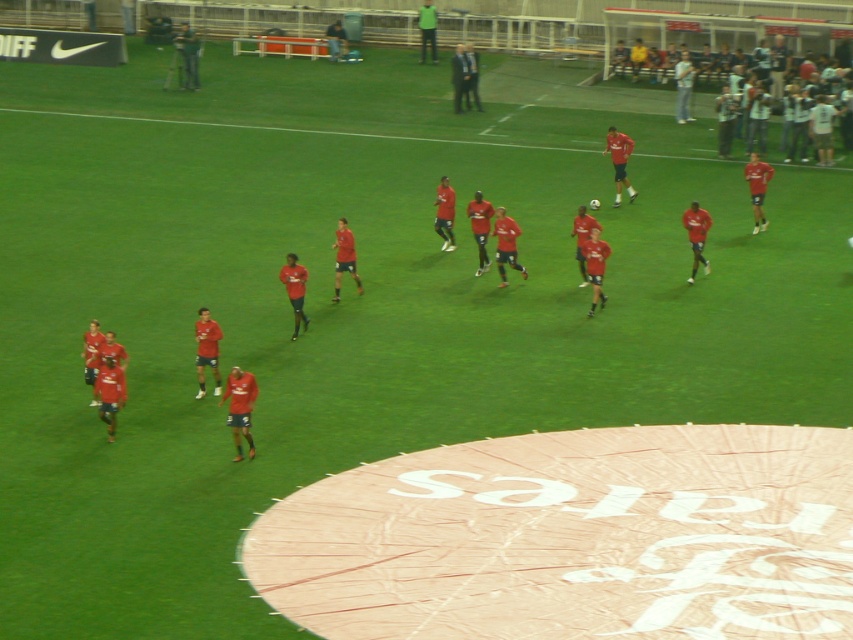
Question: Among these objects, which one is farthest from the camera?

Choices:
 (A) dark gray suit at center
 (B) matte red shirt at upper right
 (C) dark blue jeans at center

Answer: (C)

Question: Is dark gray suit at center thinner than dark blue jeans at center?

Choices:
 (A) no
 (B) yes

Answer: (A)

Question: Is matte red shirt at upper right below dark blue jeans at center?

Choices:
 (A) yes
 (B) no

Answer: (A)

Question: Which point appears farthest from the camera in this image?

Choices:
 (A) (474, 76)
 (B) (685, 74)
 (C) (421, 26)

Answer: (C)

Question: Based on their relative distances, which object is farther from the dark blue jeans at center?

Choices:
 (A) green matte shirt at upper center
 (B) dark gray suit at center
 (C) matte red shirt at upper right

Answer: (A)

Question: Can you confirm if dark gray suit at center is smaller than green matte shirt at upper center?

Choices:
 (A) yes
 (B) no

Answer: (A)